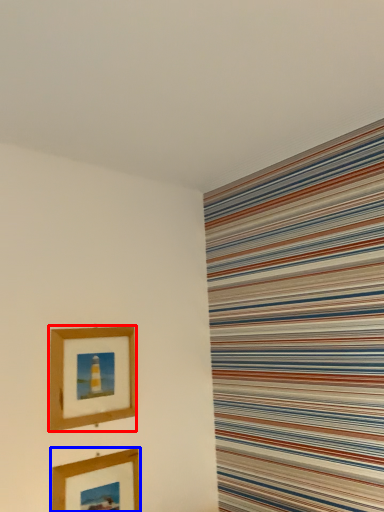
Question: Which object is further to the camera taking this photo, picture frame (highlighted by a red box) or picture frame (highlighted by a blue box)?

Choices:
 (A) picture frame
 (B) picture frame

Answer: (A)